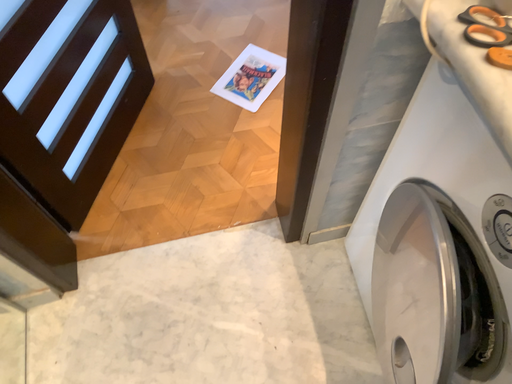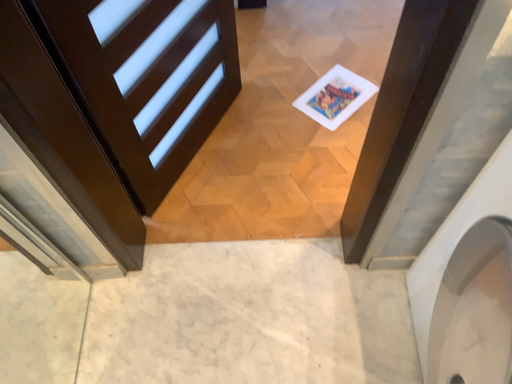
Question: Which way did the camera rotate in the video?

Choices:
 (A) rotated left
 (B) rotated right

Answer: (A)